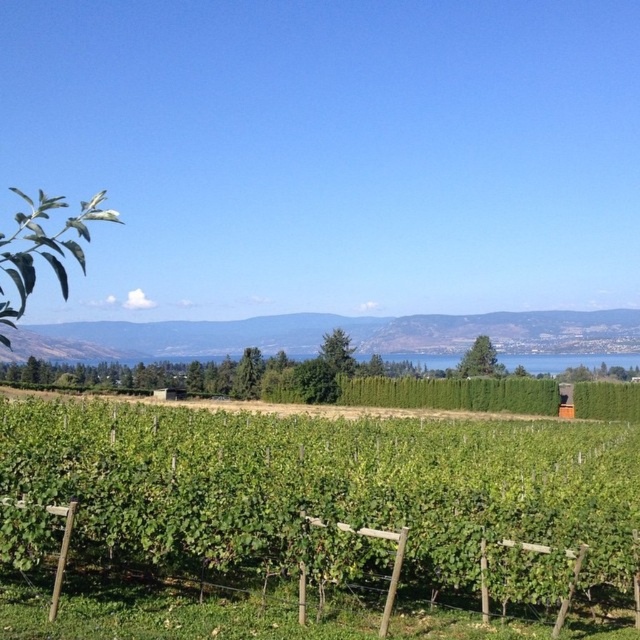
Is green hedge at center closer to the viewer compared to green leafy hedge at right?

No, it is not.

Is point (600, 364) closer to camera compared to point (595, 390)?

No, (600, 364) is behind (595, 390).

Identify the location of green hedge at center. (564, 360).

Describe the element at coordinates (339, 497) in the screenshot. I see `green leafy vines at center` at that location.

Consider the image. Between green leafy vines at center and green leafy hillside at center, which one has more height?

green leafy hillside at center

You are a GUI agent. You are given a task and a screenshot of the screen. Output one action in this format:
    pyautogui.click(x=<x>, y=<y>)
    Task: Click on the green leafy vines at center
    Image resolution: width=640 pixels, height=640 pixels.
    Given the screenshot: What is the action you would take?
    pyautogui.click(x=339, y=497)

Between green leafy hillside at center and green leafy hedge at center, which one is positioned lower?

green leafy hedge at center

Can you confirm if green leafy hillside at center is thinner than green leafy hedge at center?

In fact, green leafy hillside at center might be wider than green leafy hedge at center.

Which is behind, point (588, 333) or point (460, 406)?

Positioned behind is point (588, 333).

You are a GUI agent. You are given a task and a screenshot of the screen. Output one action in this format:
    pyautogui.click(x=<x>, y=<y>)
    Task: Click on the green leafy hillside at center
    This screenshot has height=640, width=640.
    Given the screenshot: What is the action you would take?
    pyautogui.click(x=332, y=328)